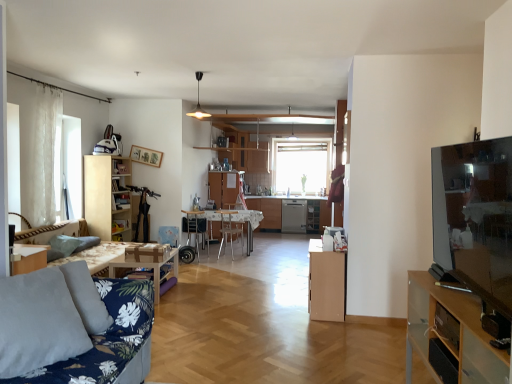
Where is `wooden chair at center, the 1th chair positioned from the left`? This screenshot has height=384, width=512. wooden chair at center, the 1th chair positioned from the left is located at coordinates (194, 227).

What do you see at coordinates (64, 244) in the screenshot? I see `green fabric pillow at lower left` at bounding box center [64, 244].

What do you see at coordinates (450, 335) in the screenshot? Image resolution: width=512 pixels, height=384 pixels. I see `transparent glass tv stand at right, which appears as the first cabinetry when viewed from the right` at bounding box center [450, 335].

Where is `wooden table at center, the 1th table in the left-to-right sequence`? Image resolution: width=512 pixels, height=384 pixels. wooden table at center, the 1th table in the left-to-right sequence is located at coordinates (146, 267).

Is matte black tv at right positioned with its back to metallic silver chair at center, which is the 2th chair from left to right?

No, matte black tv at right is not facing the opposite direction of metallic silver chair at center, which is the 2th chair from left to right.

From a real-world perspective, is matte black tv at right positioned over metallic silver chair at center, which is the 2th chair from left to right, based on gravity?

Yes, from a real-world perspective, matte black tv at right is over metallic silver chair at center, which is the 2th chair from left to right

Which object is closer to the camera, matte black tv at right or metallic silver chair at center, the first chair positioned from the right?

matte black tv at right is closer to the camera.

Is white sheer curtain at left not near wooden table at center, marked as the second table in a back-to-front arrangement?

white sheer curtain at left is far away from wooden table at center, marked as the second table in a back-to-front arrangement.

From the image's perspective, between white sheer curtain at left and wooden table at center, positioned as the 1th table in front-to-back order, who is located below?

wooden table at center, positioned as the 1th table in front-to-back order, appears lower in the image.

The image size is (512, 384). What are the coordinates of `curtain on the left of wooden table at center, positioned as the 1th table in front-to-back order` in the screenshot? It's located at (44, 157).

In the scene shown: Between white sheer curtain at left and wooden table at center, the 1th table in the left-to-right sequence, which one has larger width?

With larger width is wooden table at center, the 1th table in the left-to-right sequence.

Who is bigger, metallic silver chair at center, the first chair positioned from the right, or wooden picture frame at upper center?

Bigger between the two is metallic silver chair at center, the first chair positioned from the right.

Is metallic silver chair at center, the first chair positioned from the right, shorter than wooden picture frame at upper center?

Incorrect, the height of metallic silver chair at center, the first chair positioned from the right, does not fall short of that of wooden picture frame at upper center.

In the image, is metallic silver chair at center, which is the 2th chair from left to right, positioned in front of or behind wooden picture frame at upper center?

In the image, metallic silver chair at center, which is the 2th chair from left to right, appears behind wooden picture frame at upper center.

Which of these two, white sheer curtain at left or blue floral fabric couch at lower left, is bigger?

With larger size is blue floral fabric couch at lower left.

Does point (55, 219) lie behind point (113, 369)?

Yes, point (55, 219) is farther from viewer.

Between white sheer curtain at left and blue floral fabric couch at lower left, which one appears on the right side from the viewer's perspective?

From the viewer's perspective, blue floral fabric couch at lower left appears more on the right side.

Is white sheer curtain at left positioned far away from blue floral fabric couch at lower left?

Indeed, white sheer curtain at left is not near blue floral fabric couch at lower left.

Can you confirm if matte black tv at right is thinner than light wood bookshelf at left, the 3th cabinetry in the right-to-left sequence?

Yes.

Which of these two, matte black tv at right or light wood bookshelf at left, which ranks as the first cabinetry in back-to-front order, is smaller?

Smaller between the two is matte black tv at right.

Does matte black tv at right turn towards light wood bookshelf at left, arranged as the third cabinetry when viewed from the front?

No, matte black tv at right is not facing towards light wood bookshelf at left, arranged as the third cabinetry when viewed from the front.

From a real-world perspective, between wooden picture frame at upper center and metallic silver chair at center, the first chair positioned from the right, who is vertically higher?

From a 3D spatial view, wooden picture frame at upper center is above.

Is wooden picture frame at upper center bigger or smaller than metallic silver chair at center, the first chair positioned from the right?

Considering their sizes, wooden picture frame at upper center takes up less space than metallic silver chair at center, the first chair positioned from the right.

From the image's perspective, is wooden picture frame at upper center below metallic silver chair at center, the first chair positioned from the right?

Actually, wooden picture frame at upper center appears above metallic silver chair at center, the first chair positioned from the right, in the image.

Is wooden picture frame at upper center not close to metallic silver chair at center, the first chair positioned from the right?

Yes, wooden picture frame at upper center and metallic silver chair at center, the first chair positioned from the right, are quite far apart.

Which object is positioned more to the right, green fabric pillow at lower left or transparent glass tv stand at right, which is counted as the 3th cabinetry, starting from the back?

From the viewer's perspective, transparent glass tv stand at right, which is counted as the 3th cabinetry, starting from the back, appears more on the right side.

Is green fabric pillow at lower left next to transparent glass tv stand at right, which is counted as the 3th cabinetry, starting from the back?

green fabric pillow at lower left and transparent glass tv stand at right, which is counted as the 3th cabinetry, starting from the back, are not in contact.

Can you tell me how much green fabric pillow at lower left and transparent glass tv stand at right, which appears as the first cabinetry when viewed from the right, differ in facing direction?

The angular difference between green fabric pillow at lower left and transparent glass tv stand at right, which appears as the first cabinetry when viewed from the right, is 178 degrees.

Does green fabric pillow at lower left contain transparent glass tv stand at right, the 3th cabinetry when ordered from left to right?

No.

This screenshot has width=512, height=384. Find the location of `entertainment center that is above the metallic silver chair at center, which is the 2th chair from left to right (from a real-world perspective)`. entertainment center that is above the metallic silver chair at center, which is the 2th chair from left to right (from a real-world perspective) is located at coordinates pos(465,266).

You are a GUI agent. You are given a task and a screenshot of the screen. Output one action in this format:
    pyautogui.click(x=<x>, y=<y>)
    Task: Click on the curtain behind the wooden table at center, marked as the second table in a back-to-front arrangement
    This screenshot has width=512, height=384.
    Given the screenshot: What is the action you would take?
    pyautogui.click(x=44, y=157)

Estimate the real-world distances between objects in this image. Which object is further from green fabric pillow at lower left, light wood bookshelf at left, arranged as the third cabinetry when viewed from the front, or wooden table at center, which is counted as the 2th table, starting from the right?

The object further to green fabric pillow at lower left is light wood bookshelf at left, arranged as the third cabinetry when viewed from the front.

Which object lies nearer to the anchor point wooden picture frame at upper center, green fabric pillow at lower left or matte black tv at right?

green fabric pillow at lower left is positioned closer to the anchor wooden picture frame at upper center.

When comparing their distances from white sheer curtain at left, does light wood bookshelf at left, the 3th cabinetry in the right-to-left sequence, or wooden table at center, positioned as the 1th table in front-to-back order, seem further?

wooden table at center, positioned as the 1th table in front-to-back order, is further to white sheer curtain at left.

Based on their spatial positions, is matte black tv at right or wooden picture frame at upper center further from wooden table at center, positioned as the 1th table in front-to-back order?

matte black tv at right lies further to wooden table at center, positioned as the 1th table in front-to-back order, than the other object.

Estimate the real-world distances between objects in this image. Which object is further from white sheer curtain at left, wooden table at center, the 1th table in the left-to-right sequence, or wooden picture frame at upper center?

wooden table at center, the 1th table in the left-to-right sequence.

When comparing their distances from wooden chair at center, arranged as the second chair when viewed from the right, does white sheer curtain at left or light wood bookshelf at left, which ranks as the first cabinetry in back-to-front order, seem further?

Among the two, white sheer curtain at left is located further to wooden chair at center, arranged as the second chair when viewed from the right.

Looking at the image, which one is located further to transparent glass tv stand at right, which is counted as the 3th cabinetry, starting from the back, light brown wood cabinet at center, the second cabinetry viewed from the back, or wooden chair at center, the 1th chair positioned from the left?

Among the two, wooden chair at center, the 1th chair positioned from the left, is located further to transparent glass tv stand at right, which is counted as the 3th cabinetry, starting from the back.

Looking at this image, estimate the real-world distances between objects in this image. Which object is closer to transparent glass tv stand at right, the 1th cabinetry from the front, metallic silver chair at center, which is the 2th chair from left to right, or light brown wood cabinet at center, which is the second cabinetry from right to left?

Among the two, light brown wood cabinet at center, which is the second cabinetry from right to left, is located nearer to transparent glass tv stand at right, the 1th cabinetry from the front.

This screenshot has width=512, height=384. In order to click on entertainment center positioned between transparent glass tv stand at right, which is counted as the 3th cabinetry, starting from the back, and white glossy table at center, the second table from the left, from near to far in this screenshot , I will do `click(465, 266)`.

The image size is (512, 384). I want to click on table between blue floral fabric couch at lower left and white sheer curtain at left in the front-back direction, so click(146, 267).

This screenshot has width=512, height=384. What are the coordinates of `chair positioned between light brown wood cabinet at center, the second cabinetry viewed from the back, and wooden picture frame at upper center from near to far` in the screenshot? It's located at pos(194,227).

Locate an element on the screen. pillow between blue floral fabric couch at lower left and wooden picture frame at upper center in the front-back direction is located at coordinates (64, 244).